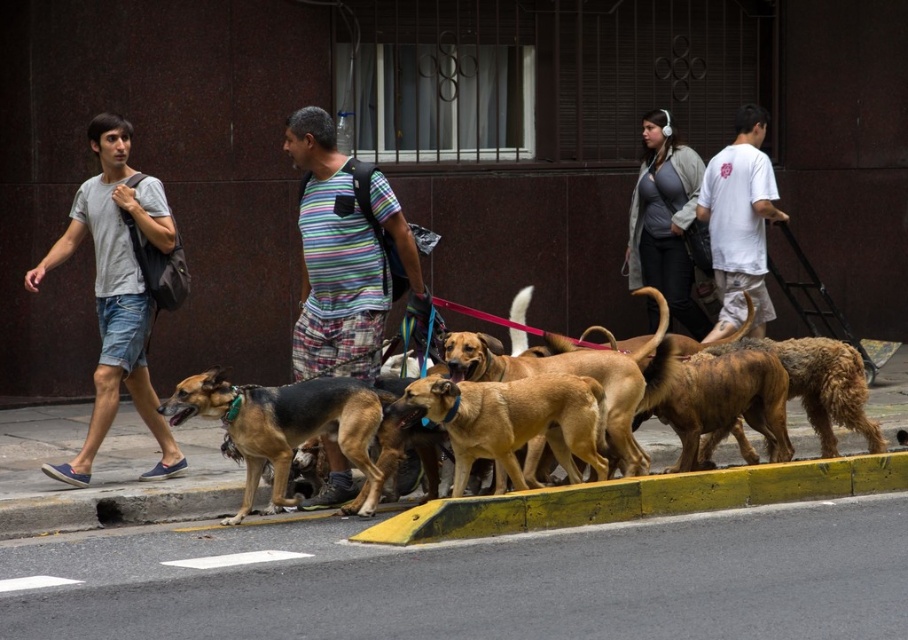
Question: Is the position of striped fabric shirt at center less distant than that of white cotton t-shirt at center-right?

Choices:
 (A) no
 (B) yes

Answer: (B)

Question: Which object is positioned farthest from the striped fabric shirt at center?

Choices:
 (A) brown and black fur dog at center
 (B) brown matte dog at center
 (C) brown fur dog at center
 (D) gray fleece jacket at upper center

Answer: (D)

Question: Is yellow asphalt at lower center further to camera compared to brown fur dog at center?

Choices:
 (A) no
 (B) yes

Answer: (A)

Question: Estimate the real-world distances between objects in this image. Which object is closer to the yellow rubber curb at lower center?

Choices:
 (A) gray fleece jacket at upper center
 (B) gray cotton t-shirt at left
 (C) white cotton t-shirt at center-right

Answer: (B)

Question: Does yellow asphalt at lower center appear under striped fabric shirt at center?

Choices:
 (A) no
 (B) yes

Answer: (B)

Question: Which point is closer to the camera?

Choices:
 (A) gray cotton t-shirt at left
 (B) brown and black fur dog at center
 (C) gray fleece jacket at upper center
 (D) white cotton t-shirt at center-right

Answer: (B)